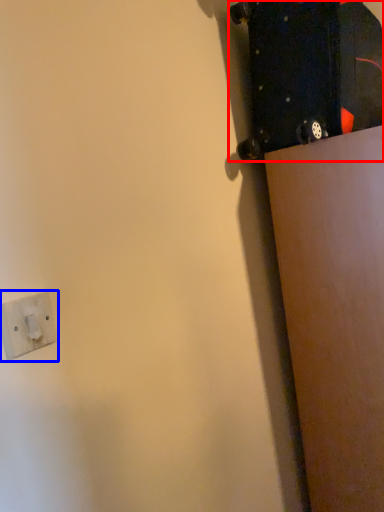
Question: Which of the following is the closest to the observer, skateboard (highlighted by a red box) or socket (highlighted by a blue box)?

Choices:
 (A) skateboard
 (B) socket

Answer: (B)